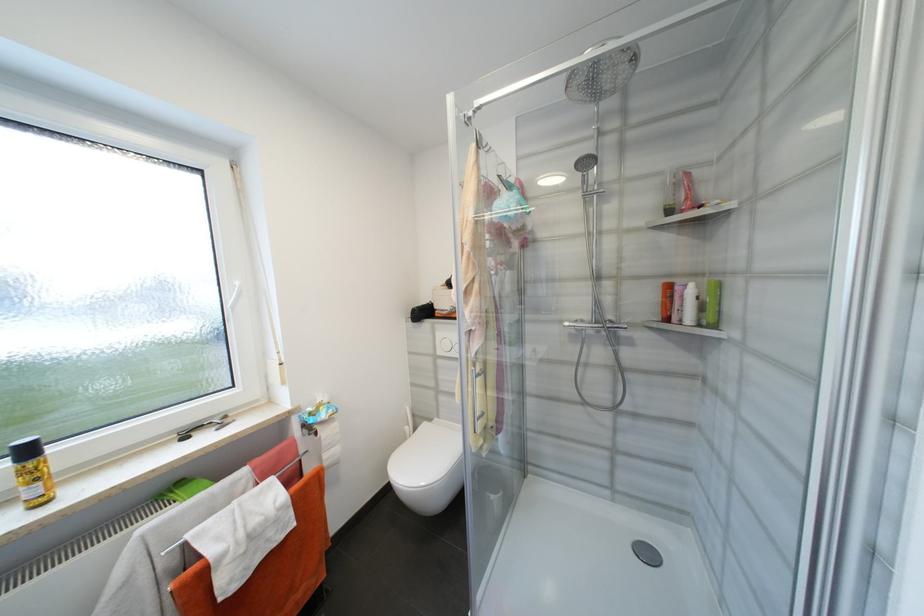
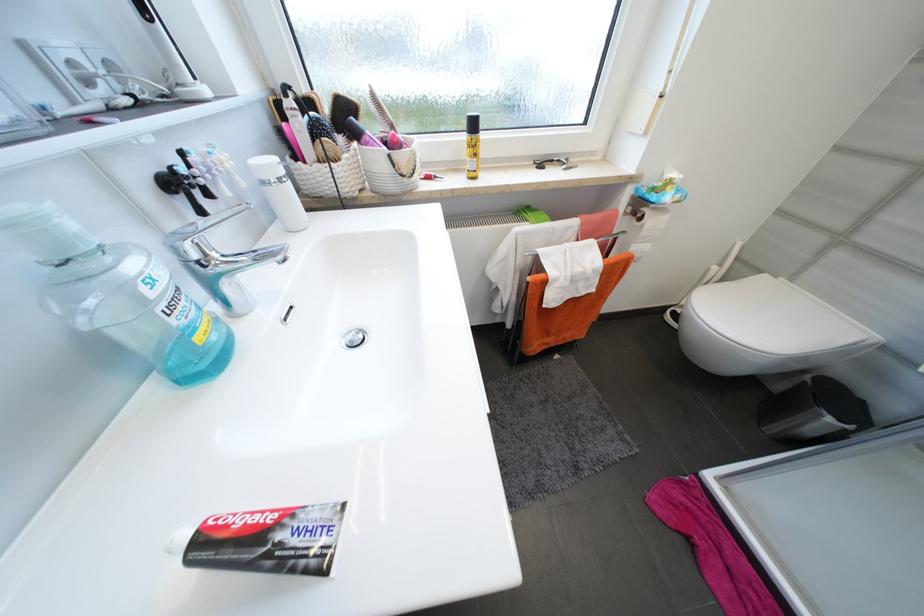
The point at [37,493] is marked in the first image. Where is the corresponding point in the second image?

(477, 166)